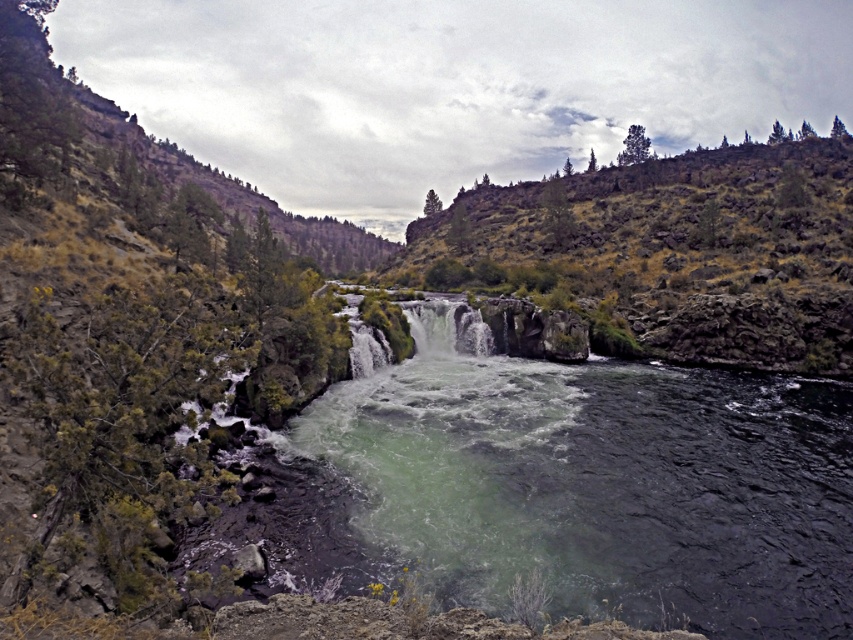
Question: Which of the following is the closest to the observer?

Choices:
 (A) (447, 404)
 (B) (469, 323)
 (C) (636, 349)

Answer: (A)

Question: Does greenish water at center appear over green mossy rock at upper center?

Choices:
 (A) yes
 (B) no

Answer: (B)

Question: Which point is closer to the camera?

Choices:
 (A) click(x=746, y=609)
 (B) click(x=584, y=292)
 (C) click(x=410, y=321)

Answer: (A)

Question: Does greenish water at center have a smaller size compared to green mossy rock at upper center?

Choices:
 (A) no
 (B) yes

Answer: (B)

Question: Is greenish water at center above green mossy rock at upper center?

Choices:
 (A) no
 (B) yes

Answer: (A)

Question: Which point is farther from the camera taking this photo?

Choices:
 (A) (440, 362)
 (B) (424, 330)
 (C) (570, 177)

Answer: (C)